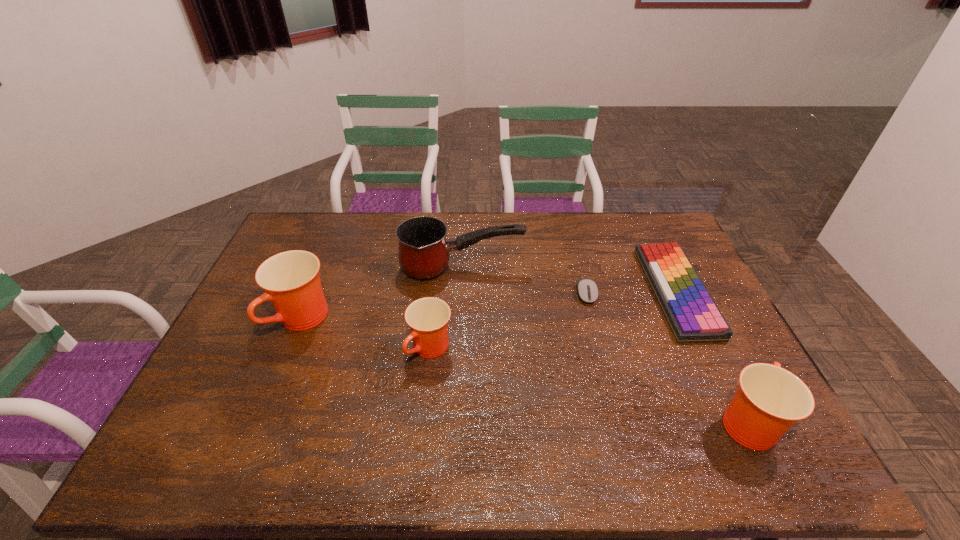
This screenshot has width=960, height=540. What are the coordinates of `vacant space that satisfies the following two spatial constraints: 1. on the handle side of the saucepan; 2. on the right side of the rightmost cup` in the screenshot? It's located at (455, 421).

Where is `vacant region that satisfies the following two spatial constraints: 1. on the front side of the leftmost cup; 2. on the left side of the rightmost cup`? The image size is (960, 540). vacant region that satisfies the following two spatial constraints: 1. on the front side of the leftmost cup; 2. on the left side of the rightmost cup is located at coordinates (262, 421).

This screenshot has height=540, width=960. What are the coordinates of `free region that satisfies the following two spatial constraints: 1. on the handle side of the saucepan; 2. on the left side of the computer keyboard` in the screenshot? It's located at (461, 292).

Where is `free space that satisfies the following two spatial constraints: 1. on the front side of the rightmost cup; 2. on the right side of the leftmost cup`? free space that satisfies the following two spatial constraints: 1. on the front side of the rightmost cup; 2. on the right side of the leftmost cup is located at coordinates (262, 421).

I want to click on vacant space that satisfies the following two spatial constraints: 1. on the handle side of the saucepan; 2. on the left side of the rightmost cup, so [x=455, y=421].

The width and height of the screenshot is (960, 540). In order to click on free spot that satisfies the following two spatial constraints: 1. on the handle side of the computer keyboard; 2. on the left side of the saucepan in this screenshot , I will do `click(461, 292)`.

This screenshot has height=540, width=960. I want to click on free spot that satisfies the following two spatial constraints: 1. on the back side of the second shortest object; 2. on the handle side of the saucepan, so click(665, 268).

Image resolution: width=960 pixels, height=540 pixels. In order to click on vacant space that satisfies the following two spatial constraints: 1. on the handle side of the saucepan; 2. on the front side of the third shortest object in this screenshot , I will do `click(458, 349)`.

You are a GUI agent. You are given a task and a screenshot of the screen. Output one action in this format:
    pyautogui.click(x=<x>, y=<y>)
    Task: Click on the vacant space that satisfies the following two spatial constraints: 1. on the handle side of the saucepan; 2. on the back side of the second shortest object
    
    Given the screenshot: What is the action you would take?
    pyautogui.click(x=461, y=292)